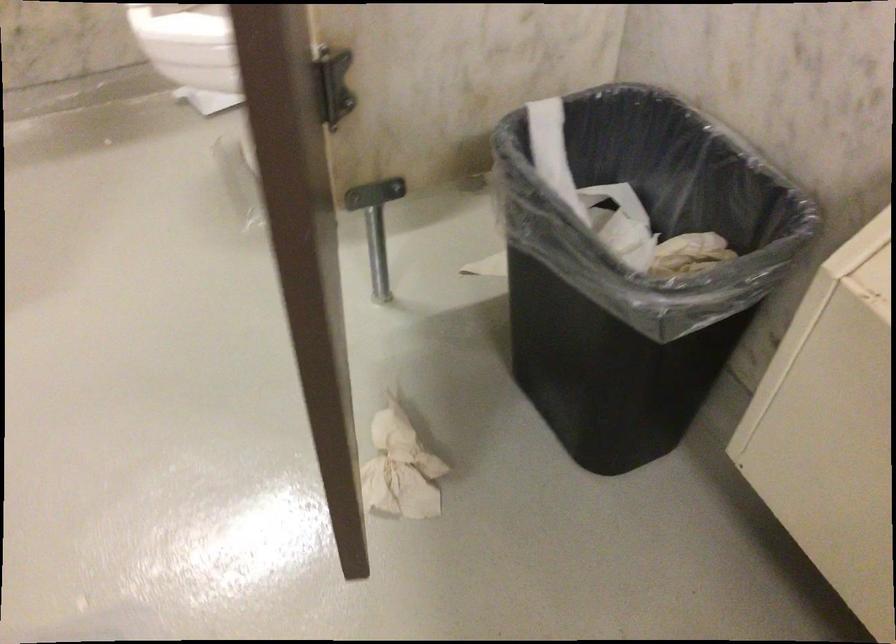
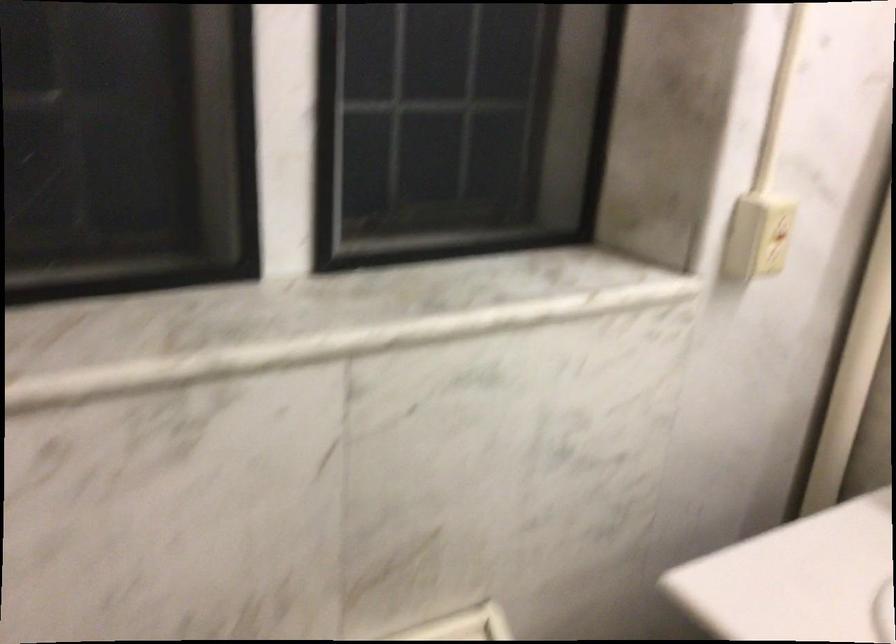
Based on the continuous images, in which direction is the camera rotating?

The rotation direction of the camera is right-down.